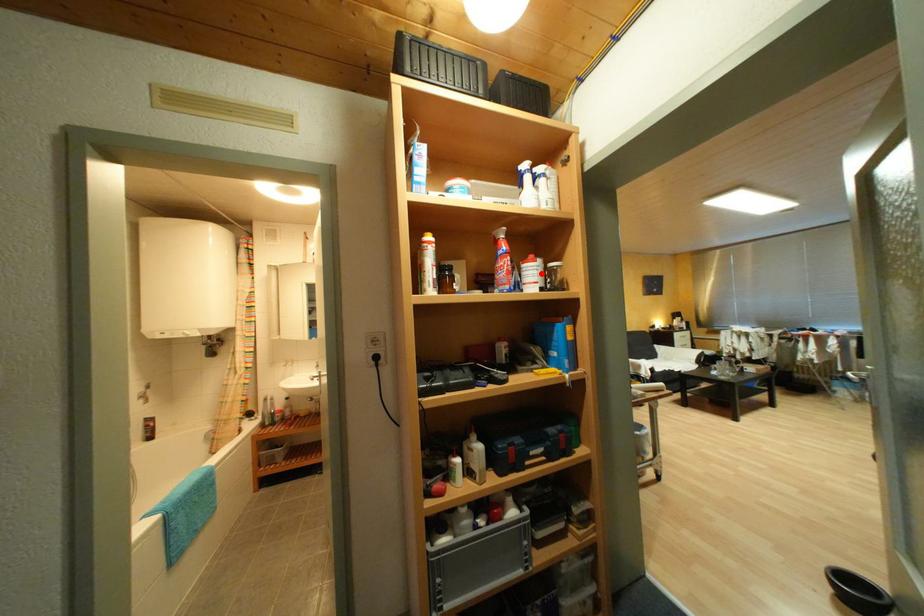
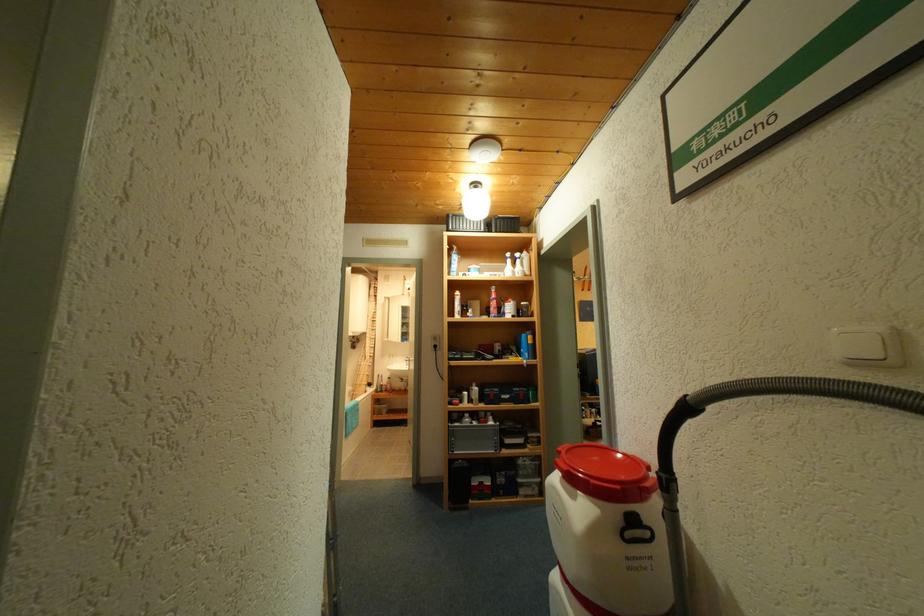
Locate, in the second image, the point that corresponds to the highlighted location in the first image.

(518, 309)